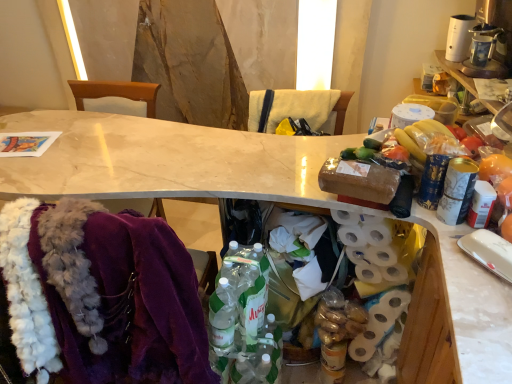
Question: Is white marble desk at center facing towards purple fabric chair at left, the first chair viewed from the left?

Choices:
 (A) no
 (B) yes

Answer: (B)

Question: Is white marble desk at center positioned beyond the bounds of purple fabric chair at left, positioned as the 2th chair in right-to-left order?

Choices:
 (A) yes
 (B) no

Answer: (A)

Question: From the image's perspective, is white marble desk at center over purple fabric chair at left, positioned as the 2th chair in right-to-left order?

Choices:
 (A) no
 (B) yes

Answer: (A)

Question: Is purple fabric chair at left, the first chair viewed from the left, at the back of white marble desk at center?

Choices:
 (A) yes
 (B) no

Answer: (A)

Question: Considering the relative sizes of white marble desk at center and purple fabric chair at left, positioned as the 2th chair in right-to-left order, in the image provided, is white marble desk at center thinner than purple fabric chair at left, positioned as the 2th chair in right-to-left order,?

Choices:
 (A) no
 (B) yes

Answer: (A)

Question: In terms of height, does white matte toilet paper at right look taller or shorter compared to purple fabric chair at left, positioned as the 2th chair in right-to-left order?

Choices:
 (A) short
 (B) tall

Answer: (A)

Question: Is white matte toilet paper at right wider or thinner than purple fabric chair at left, the first chair viewed from the left?

Choices:
 (A) thin
 (B) wide

Answer: (A)

Question: Does point (369, 248) appear closer or farther from the camera than point (119, 91)?

Choices:
 (A) closer
 (B) farther

Answer: (A)

Question: Choose the correct answer: Is white matte toilet paper at right inside purple fabric chair at left, the first chair viewed from the left, or outside it?

Choices:
 (A) outside
 (B) inside

Answer: (A)

Question: Looking at their shapes, would you say yellow fabric at upper center is wider or thinner than brown fabric chair at center, which is the second chair from left to right?

Choices:
 (A) thin
 (B) wide

Answer: (A)

Question: From their relative heights in the image, would you say yellow fabric at upper center is taller or shorter than brown fabric chair at center, which is the second chair from left to right?

Choices:
 (A) tall
 (B) short

Answer: (B)

Question: From the image's perspective, is yellow fabric at upper center positioned above or below brown fabric chair at center, the 1th chair positioned from the right?

Choices:
 (A) below
 (B) above

Answer: (B)

Question: From a real-world perspective, is yellow fabric at upper center above or below brown fabric chair at center, the 1th chair positioned from the right?

Choices:
 (A) above
 (B) below

Answer: (A)

Question: In the image, is brown fabric chair at center, the 1th chair positioned from the right, on the left side or the right side of translucent plastic bottles at center?

Choices:
 (A) right
 (B) left

Answer: (A)

Question: Is brown fabric chair at center, the 1th chair positioned from the right, in front of or behind translucent plastic bottles at center in the image?

Choices:
 (A) behind
 (B) front

Answer: (B)